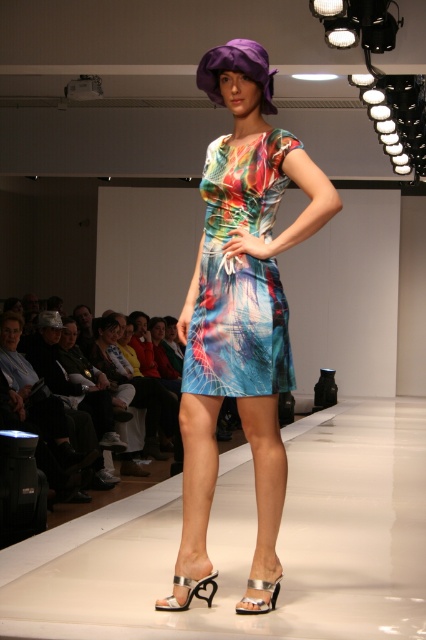
Question: Among these objects, which one is farthest from the camera?

Choices:
 (A) printed fabric dress at center
 (B) metallic silver sandals at center

Answer: (A)

Question: Can you confirm if metallic silver sandals at center is smaller than printed fabric dress at center?

Choices:
 (A) yes
 (B) no

Answer: (B)

Question: Is printed fabric dress at center further to the viewer compared to multicolored printed fabric dress at center?

Choices:
 (A) no
 (B) yes

Answer: (A)

Question: Which object is the farthest from the multicolored printed fabric dress at center?

Choices:
 (A) printed fabric dress at center
 (B) metallic silver sandals at center

Answer: (B)

Question: Estimate the real-world distances between objects in this image. Which object is farther from the multicolored printed fabric dress at center?

Choices:
 (A) printed fabric dress at center
 (B) metallic silver sandals at center

Answer: (B)

Question: In this image, where is metallic silver sandals at center located relative to multicolored printed fabric dress at center?

Choices:
 (A) below
 (B) above

Answer: (A)